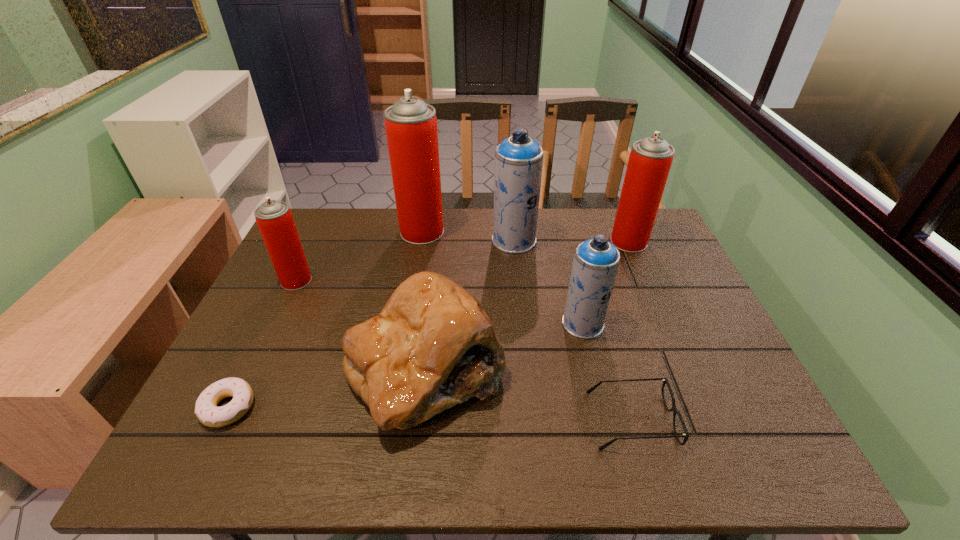
This screenshot has height=540, width=960. In order to click on vacant space that satisfies the following two spatial constraints: 1. on the back side of the nearest red aerosol can; 2. on the left side of the second red aerosol can from right to left in this screenshot , I will do `click(320, 232)`.

This screenshot has width=960, height=540. In order to click on vacant area in the image that satisfies the following two spatial constraints: 1. on the front side of the rightmost aerosol can; 2. with the lenses facing outward on the second shortest object in this screenshot , I will do `click(705, 420)`.